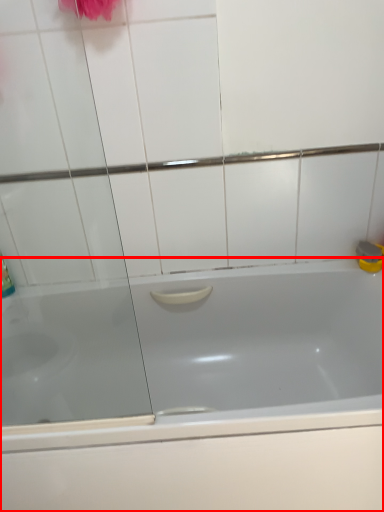
Question: From the image's perspective, what is the correct spatial positioning of bathtub (annotated by the red box) in reference to screen door?

Choices:
 (A) below
 (B) above

Answer: (A)